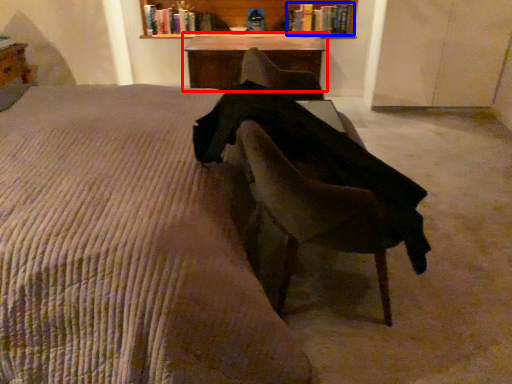
Question: Which of the following is the closest to the observer, table (highlighted by a red box) or book (highlighted by a blue box)?

Choices:
 (A) table
 (B) book

Answer: (A)